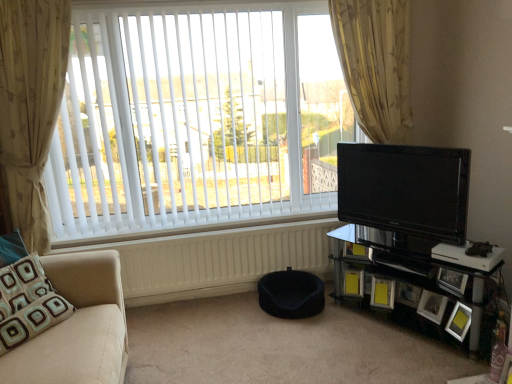
At what (x,y) coordinates should I click in order to perform the action: click on free spot in front of yellow paper at lower right, the 2th picture frame when ordered from left to right. Please return your answer as a coordinate pair (x, y). Looking at the image, I should click on (394, 319).